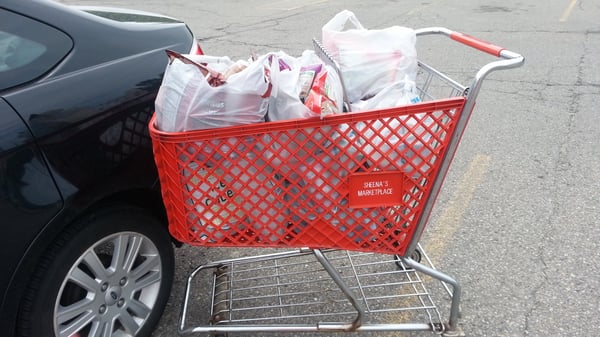
The width and height of the screenshot is (600, 337). Find the location of `handle`. handle is located at coordinates (481, 43).